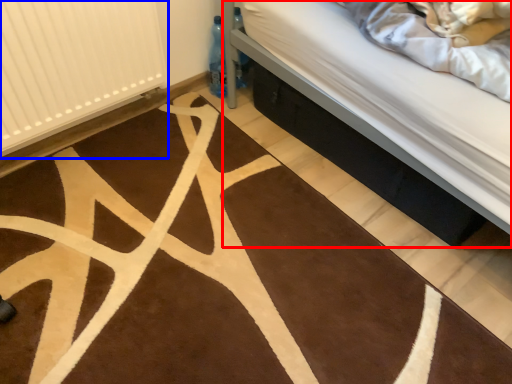
Question: Which point is closer to the camera, bed (highlighted by a red box) or radiator (highlighted by a blue box)?

Choices:
 (A) bed
 (B) radiator

Answer: (B)